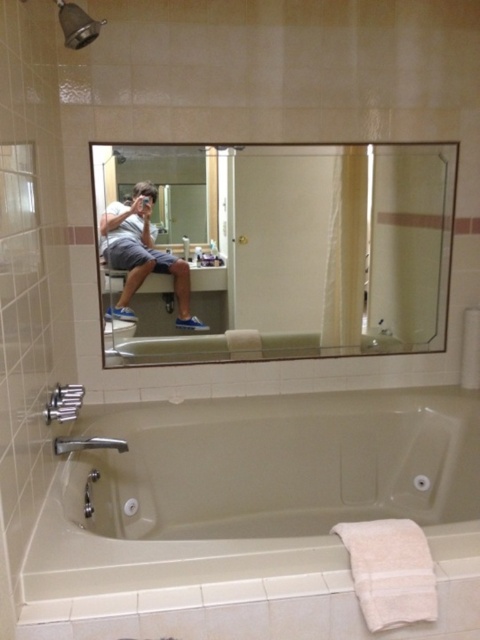
Which is behind, point (276, 237) or point (172, 266)?

The point (276, 237) is behind.

Is clear glass mirror at upper center shorter than matte gray shorts at center?

No.

The height and width of the screenshot is (640, 480). In order to click on clear glass mirror at upper center in this screenshot , I will do `click(275, 250)`.

Which of these two, clear glass mirror at upper center or metallic showerhead at upper left, stands taller?

clear glass mirror at upper center

Is clear glass mirror at upper center positioned in front of metallic showerhead at upper left?

No, it is not.

Is point (300, 145) in front of point (61, 20)?

That is False.

What are the coordinates of `clear glass mirror at upper center` in the screenshot? It's located at pyautogui.click(x=275, y=250).

Who is shorter, clear glass mirror at upper center or beige ceramic bathtub at lower center?

beige ceramic bathtub at lower center

In the scene shown: Can you confirm if clear glass mirror at upper center is taller than beige ceramic bathtub at lower center?

Yes, clear glass mirror at upper center is taller than beige ceramic bathtub at lower center.

Who is more distant from viewer, (398, 225) or (112, 436)?

The point (398, 225) is more distant.

Where is `clear glass mirror at upper center`? This screenshot has height=640, width=480. clear glass mirror at upper center is located at coordinates (275, 250).